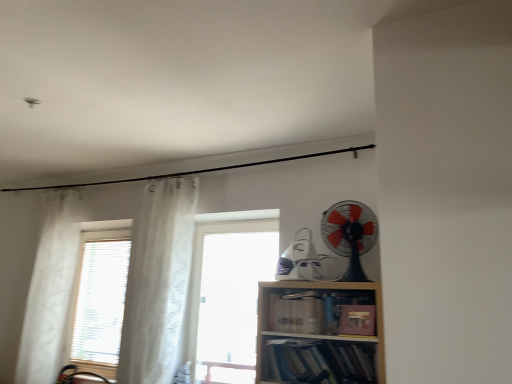
Question: From a real-world perspective, does black plastic fan at upper right stand above transparent glass window at center?

Choices:
 (A) no
 (B) yes

Answer: (B)

Question: Is black plastic fan at upper right facing away from transparent glass window at center?

Choices:
 (A) yes
 (B) no

Answer: (B)

Question: Considering the relative sizes of black plastic fan at upper right and transparent glass window at center in the image provided, is black plastic fan at upper right smaller than transparent glass window at center?

Choices:
 (A) yes
 (B) no

Answer: (A)

Question: Is black plastic fan at upper right closer to camera compared to transparent glass window at center?

Choices:
 (A) yes
 (B) no

Answer: (A)

Question: Is black plastic fan at upper right surrounding transparent glass window at center?

Choices:
 (A) no
 (B) yes

Answer: (A)

Question: Can you confirm if black plastic fan at upper right is thinner than transparent glass window at center?

Choices:
 (A) no
 (B) yes

Answer: (A)

Question: From the image's perspective, would you say black plastic fan at upper right is shown under white sheer curtain at left, which is counted as the first curtain, starting from the right?

Choices:
 (A) yes
 (B) no

Answer: (B)

Question: Can you confirm if black plastic fan at upper right is bigger than white sheer curtain at left, arranged as the second curtain when viewed from the left?

Choices:
 (A) yes
 (B) no

Answer: (B)

Question: Is the position of black plastic fan at upper right less distant than that of white sheer curtain at left, which is counted as the first curtain, starting from the right?

Choices:
 (A) no
 (B) yes

Answer: (B)

Question: From a real-world perspective, is black plastic fan at upper right below white sheer curtain at left, arranged as the second curtain when viewed from the left?

Choices:
 (A) yes
 (B) no

Answer: (B)

Question: Is black plastic fan at upper right oriented towards white sheer curtain at left, arranged as the second curtain when viewed from the left?

Choices:
 (A) yes
 (B) no

Answer: (B)

Question: From a real-world perspective, is black plastic fan at upper right on white sheer curtain at left, which is counted as the first curtain, starting from the right?

Choices:
 (A) yes
 (B) no

Answer: (A)

Question: Considering the relative positions of black plastic fan at upper right and hardcover books at lower center, the 3th book from the top, in the image provided, is black plastic fan at upper right to the right of hardcover books at lower center, the 3th book from the top, from the viewer's perspective?

Choices:
 (A) no
 (B) yes

Answer: (B)